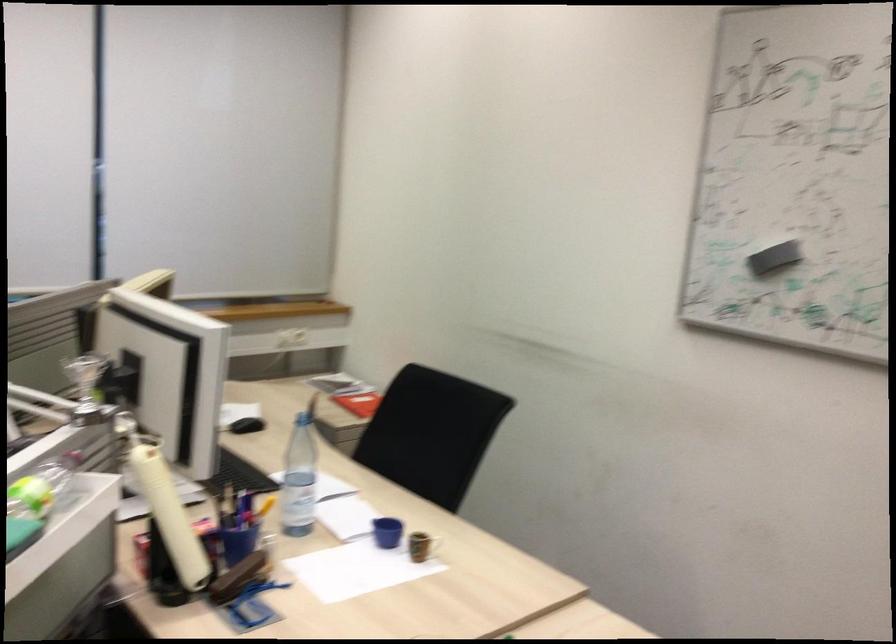
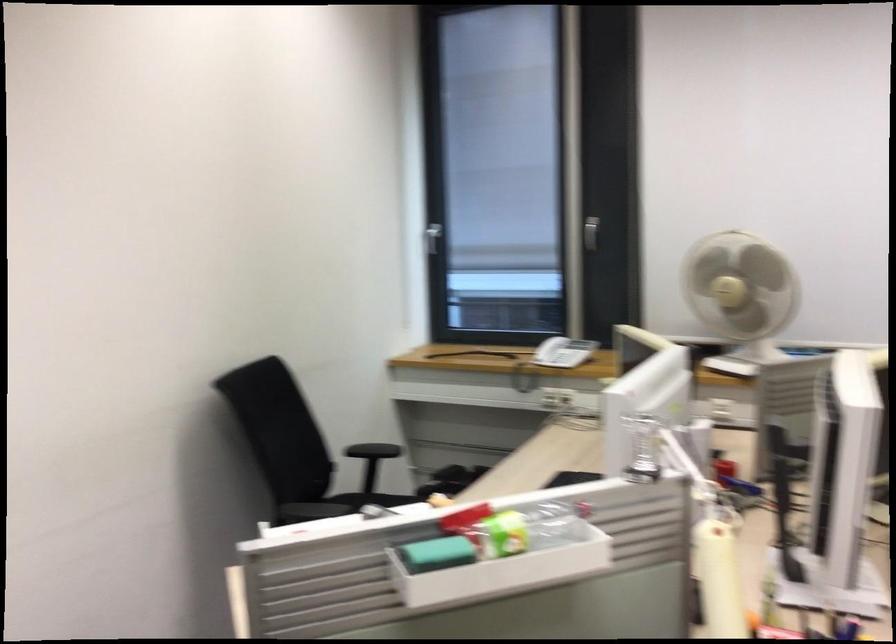
Question: The images are taken continuously from a first-person perspective. In which direction is your viewpoint rotating?

Choices:
 (A) Left
 (B) Right
 (C) Up
 (D) Down

Answer: (A)